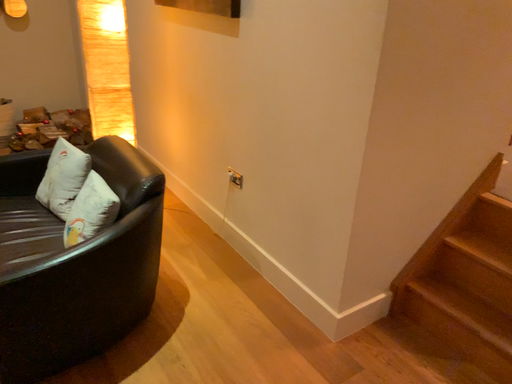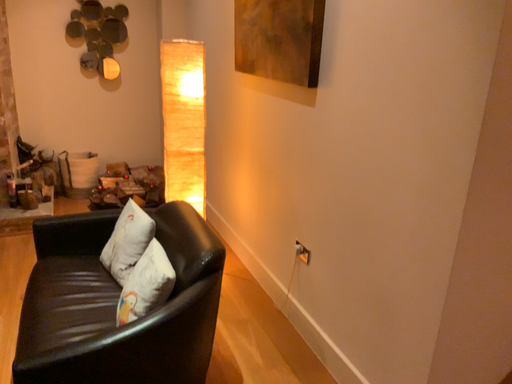
Question: How did the camera likely rotate when shooting the video?

Choices:
 (A) rotated left
 (B) rotated right

Answer: (A)